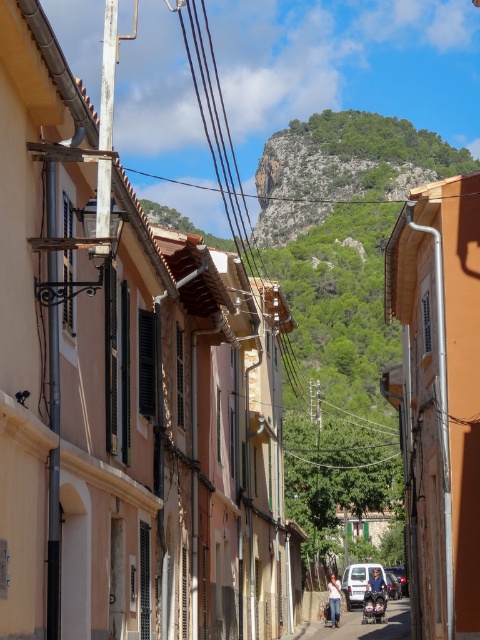
Question: Among these points, which one is nearest to the camera?

Choices:
 (A) (380, 605)
 (B) (359, 572)
 (C) (398, 577)

Answer: (A)

Question: Which of the following is the farthest from the observer?

Choices:
 (A) (363, 595)
 (B) (400, 572)

Answer: (B)

Question: Which point is farther to the camera?

Choices:
 (A) tap(351, 570)
 (B) tap(404, 570)
 (C) tap(384, 588)

Answer: (B)

Question: From the image, what is the correct spatial relationship of metallic silver motorcycle at center in relation to metallic silver car at center?

Choices:
 (A) above
 (B) below

Answer: (A)

Question: Is matte silver car at center bigger than metallic silver car at center?

Choices:
 (A) yes
 (B) no

Answer: (A)

Question: Does metallic silver motorcycle at center appear over metallic silver car at center?

Choices:
 (A) yes
 (B) no

Answer: (A)